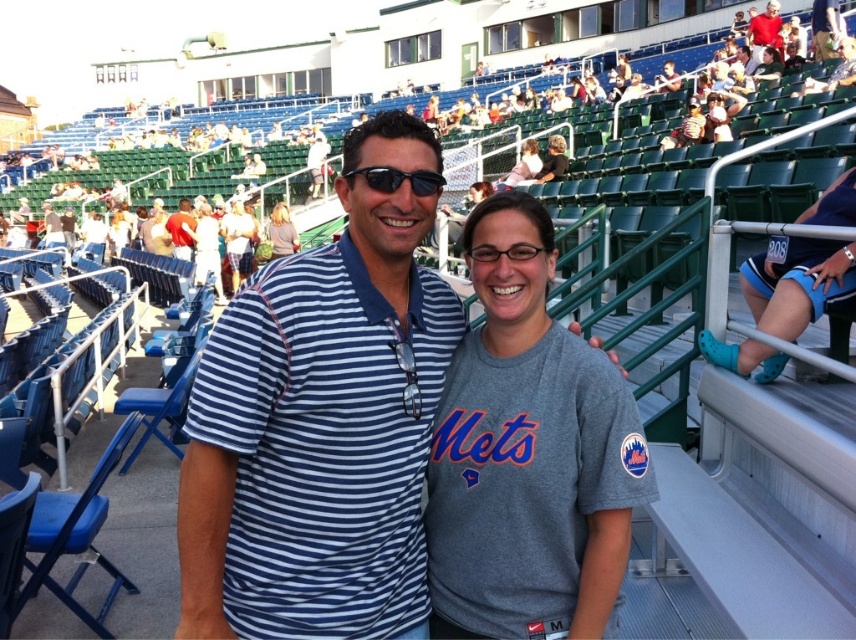
You are standing at the point labeled point (253, 301) in the baseball stadium scene. You want to take a photo of the two people in the foreground using a camera that has a 50mm lens. Considering the distance between you and the camera, will the subjects be in focus if the depth of field at 50mm allows for sharpness within 10 meters?

The distance between point (253, 301) and the camera is 10.87 meters, which exceeds the 10 meter depth of field limit. Therefore, the subjects will not be in focus.